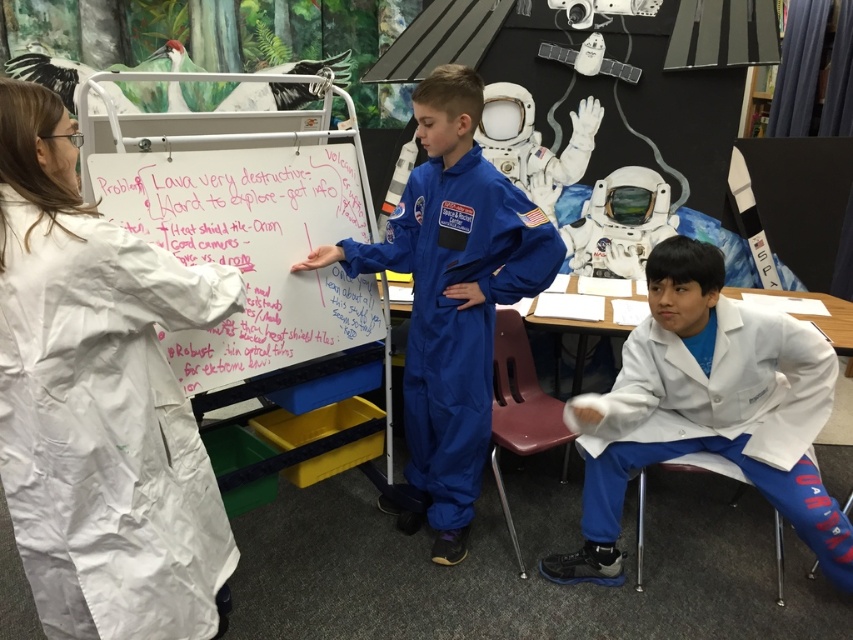
Question: Among these objects, which one is nearest to the camera?

Choices:
 (A) white matte lab coat at lower right
 (B) blue smooth jumpsuit at center
 (C) whiteboard at center

Answer: (C)

Question: Is white matte lab coat at lower right thinner than blue smooth jumpsuit at center?

Choices:
 (A) yes
 (B) no

Answer: (B)

Question: Which object is positioned closest to the whiteboard at center?

Choices:
 (A) white matte lab coat at lower right
 (B) blue smooth jumpsuit at center

Answer: (B)

Question: Which point appears farthest from the camera in this image?

Choices:
 (A) (444, 102)
 (B) (322, 211)

Answer: (B)

Question: Does white matte lab coat at lower right appear on the right side of blue smooth jumpsuit at center?

Choices:
 (A) no
 (B) yes

Answer: (B)

Question: Is blue smooth jumpsuit at center closer to camera compared to whiteboard at center?

Choices:
 (A) yes
 (B) no

Answer: (B)